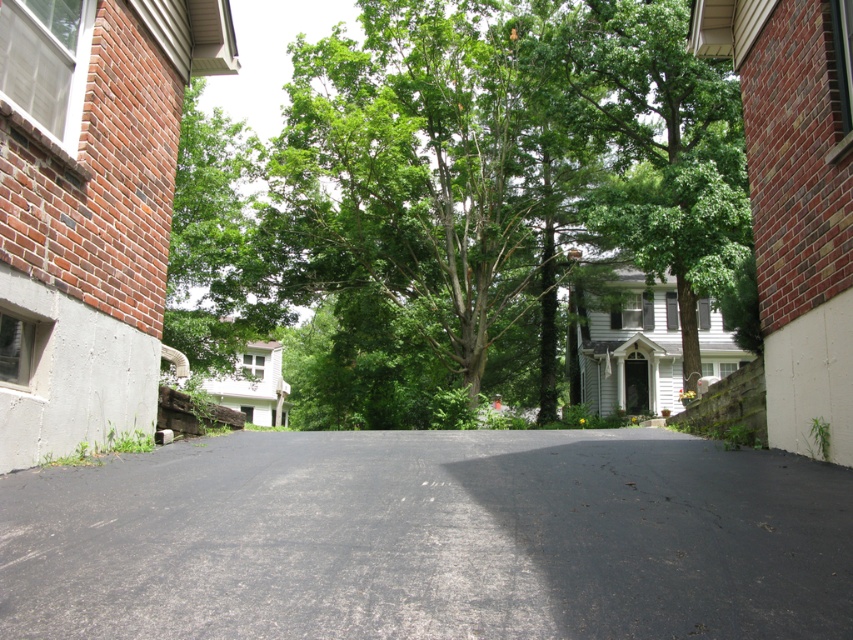
Question: Is the position of green leafy tree at center less distant than that of black asphalt driveway at center?

Choices:
 (A) yes
 (B) no

Answer: (B)

Question: Can you confirm if green leafy tree at center is positioned to the right of black asphalt driveway at center?

Choices:
 (A) no
 (B) yes

Answer: (B)

Question: Which of the following is the closest to the observer?

Choices:
 (A) black asphalt driveway at center
 (B) green leafy tree at center

Answer: (A)

Question: Does green leafy tree at center come behind black asphalt driveway at center?

Choices:
 (A) no
 (B) yes

Answer: (B)